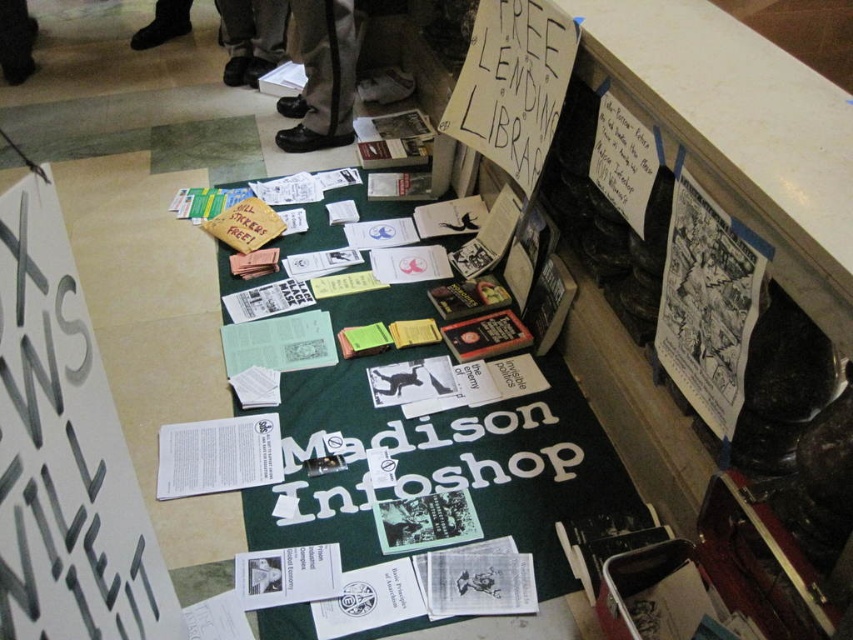
You are standing in front of the Madison Infoshop display. You see the green paper at center and the black leather shoes at upper center. Which object is closer to you?

The green paper at center is closer to you because it is in front of the black leather shoes at upper center.

You are organizing a community event and need to place a 12 inch tall sign. You have two papers available, the green paper at center and the white paper at lower left. Which paper can accommodate the sign without it being too short?

The green paper at center is much taller than the white paper at lower left, so the green paper at center can accommodate the 12 inch tall sign without it being too short.

You are standing in front of the Madison Infoshop display and need to pick up both the green paper at center and the white paper at lower left. Which paper should you reach for first to avoid blocking the other?

You should reach for the green paper at center first because it is closer to you than the white paper at lower left, so picking it up first will prevent blocking access to the white paper at lower left.